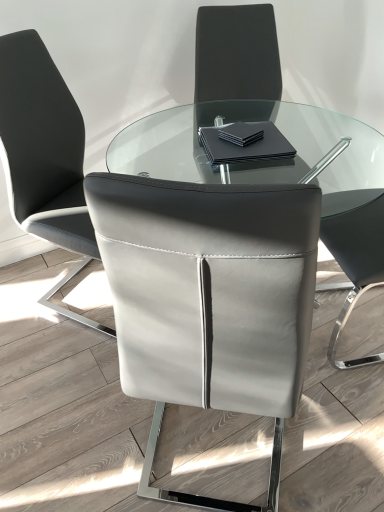
Question: Could you tell me if white leather chair at center, positioned as the first chair in left-to-right order, is turned towards black matte napkin at center?

Choices:
 (A) no
 (B) yes

Answer: (B)

Question: Is white leather chair at center, marked as the 2th chair in a right-to-left arrangement, positioned beyond the bounds of black matte napkin at center?

Choices:
 (A) yes
 (B) no

Answer: (A)

Question: Can you confirm if white leather chair at center, positioned as the first chair in left-to-right order, is positioned to the left of black matte napkin at center?

Choices:
 (A) no
 (B) yes

Answer: (B)

Question: From a real-world perspective, is white leather chair at center, positioned as the first chair in left-to-right order, over black matte napkin at center?

Choices:
 (A) yes
 (B) no

Answer: (B)

Question: Is white leather chair at center, marked as the 2th chair in a right-to-left arrangement, at the right side of black matte napkin at center?

Choices:
 (A) no
 (B) yes

Answer: (A)

Question: Is point (249, 156) positioned closer to the camera than point (21, 153)?

Choices:
 (A) closer
 (B) farther

Answer: (A)

Question: In terms of height, does black matte napkin at center look taller or shorter compared to white leather chair at center, positioned as the first chair in left-to-right order?

Choices:
 (A) short
 (B) tall

Answer: (A)

Question: From the image's perspective, is black matte napkin at center above or below white leather chair at center, marked as the 2th chair in a right-to-left arrangement?

Choices:
 (A) below
 (B) above

Answer: (B)

Question: From a real-world perspective, is black matte napkin at center physically located above or below white leather chair at center, marked as the 2th chair in a right-to-left arrangement?

Choices:
 (A) below
 (B) above

Answer: (B)

Question: Is matte gray leather chair at center, which is counted as the 1th chair, starting from the right, taller or shorter than white leather chair at center, positioned as the first chair in left-to-right order?

Choices:
 (A) short
 (B) tall

Answer: (A)

Question: Is matte gray leather chair at center, the 2th chair when ordered from left to right, bigger or smaller than white leather chair at center, marked as the 2th chair in a right-to-left arrangement?

Choices:
 (A) small
 (B) big

Answer: (A)

Question: Is matte gray leather chair at center, the 2th chair when ordered from left to right, situated inside white leather chair at center, marked as the 2th chair in a right-to-left arrangement, or outside?

Choices:
 (A) inside
 (B) outside

Answer: (B)

Question: Is matte gray leather chair at center, which is counted as the 1th chair, starting from the right, in front of or behind white leather chair at center, marked as the 2th chair in a right-to-left arrangement, in the image?

Choices:
 (A) front
 (B) behind

Answer: (A)

Question: Is white leather chair at center, marked as the 2th chair in a right-to-left arrangement, wider or thinner than black matte napkin at center?

Choices:
 (A) wide
 (B) thin

Answer: (A)

Question: Considering their positions, is white leather chair at center, positioned as the first chair in left-to-right order, located in front of or behind black matte napkin at center?

Choices:
 (A) behind
 (B) front

Answer: (B)